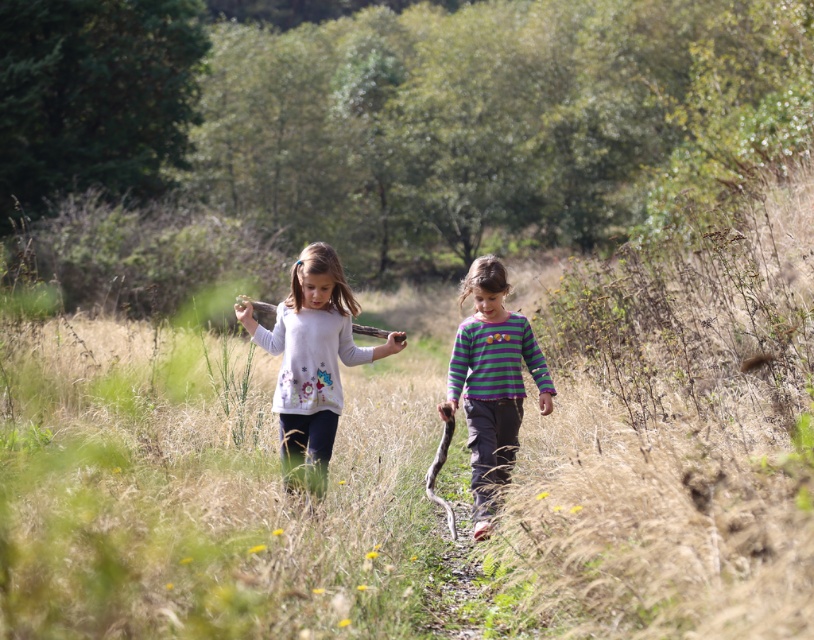
You are a photographer trying to capture a shot of the two girls in the grassy field. You notice the white matte sweater at center and the striped cotton shirt at center. Which clothing item should you focus on to ensure it appears in front of the other?

The white matte sweater at center is above the striped cotton shirt at center, so focusing on the white matte sweater at center will ensure it appears in front of the striped cotton shirt at center.

You are a photographer trying to capture a photo of the two children in the grassy field. You want to ensure that the white matte sweater at center and the striped cotton shirt at center are both clearly visible in the frame. Based on their positions, which child should you focus on first to ensure both are in focus?

The white matte sweater at center is positioned on the left side of striped cotton shirt at center. To ensure both are in focus, you should focus on the striped cotton shirt at center first since it is closer to the center of the frame, allowing the leftward white matte sweater at center to be within the depth of field.

You are a photographer trying to capture the two girls in the grassy field. You notice a point at coordinates (311, 362) in the image. Based on the scene description, what object is located at that point?

The point at coordinates (311, 362) is on the white matte sweater at center.